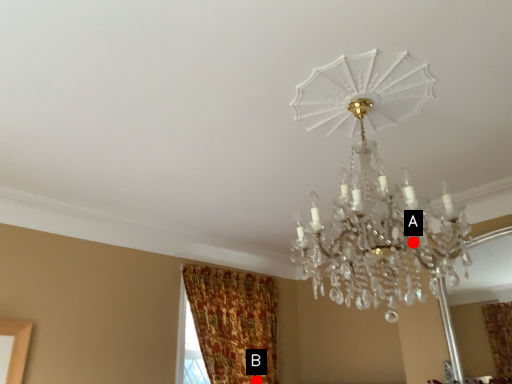
Question: Two points are circled on the image, labeled by A and B beside each circle. Which point is farther to the camera?

Choices:
 (A) A is further
 (B) B is further

Answer: (B)